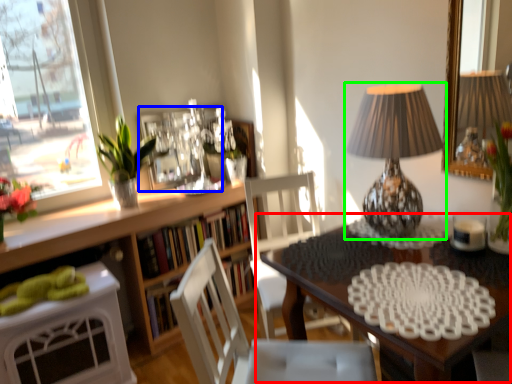
Question: Estimate the real-world distances between objects in this image. Which object is farther from table (highlighted by a red box), picture frame (highlighted by a blue box) or lamp (highlighted by a green box)?

Choices:
 (A) picture frame
 (B) lamp

Answer: (A)